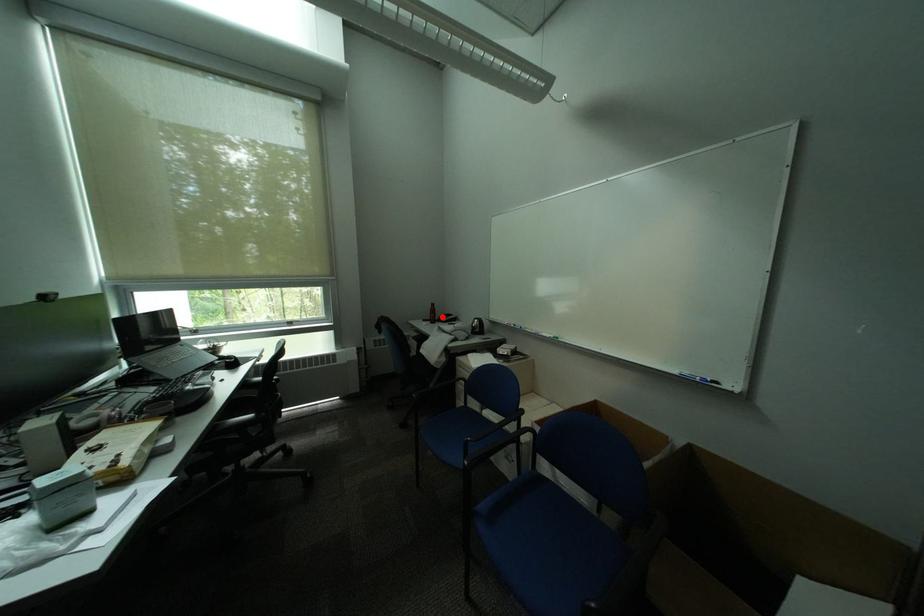
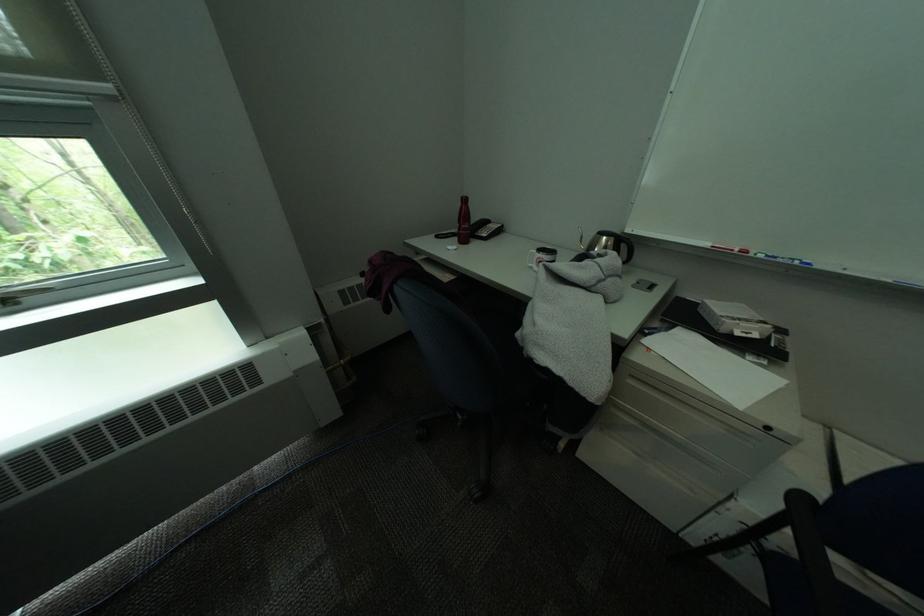
Find the pixel in the second image that matches the highlighted location in the first image.

(475, 228)